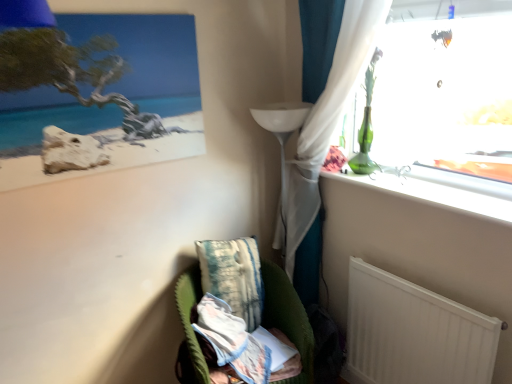
Question: From a real-world perspective, is velvet green armchair at lower center positioned under matte wooden picture frame at upper left based on gravity?

Choices:
 (A) yes
 (B) no

Answer: (A)

Question: Is velvet green armchair at lower center thinner than matte wooden picture frame at upper left?

Choices:
 (A) yes
 (B) no

Answer: (B)

Question: Is velvet green armchair at lower center positioned with its back to matte wooden picture frame at upper left?

Choices:
 (A) yes
 (B) no

Answer: (B)

Question: Considering the relative sizes of velvet green armchair at lower center and matte wooden picture frame at upper left in the image provided, is velvet green armchair at lower center bigger than matte wooden picture frame at upper left?

Choices:
 (A) yes
 (B) no

Answer: (A)

Question: Is the depth of velvet green armchair at lower center greater than that of matte wooden picture frame at upper left?

Choices:
 (A) no
 (B) yes

Answer: (B)

Question: Is velvet green armchair at lower center not close to matte wooden picture frame at upper left?

Choices:
 (A) no
 (B) yes

Answer: (B)

Question: From the image's perspective, is white matte radiator at lower right under velvet green armchair at lower center?

Choices:
 (A) yes
 (B) no

Answer: (B)

Question: Is white matte radiator at lower right bigger than velvet green armchair at lower center?

Choices:
 (A) no
 (B) yes

Answer: (A)

Question: Is white matte radiator at lower right turned away from velvet green armchair at lower center?

Choices:
 (A) no
 (B) yes

Answer: (A)

Question: Does white matte radiator at lower right appear on the left side of velvet green armchair at lower center?

Choices:
 (A) yes
 (B) no

Answer: (B)

Question: Is white matte radiator at lower right wider than velvet green armchair at lower center?

Choices:
 (A) no
 (B) yes

Answer: (A)

Question: Is white matte radiator at lower right closer to camera compared to velvet green armchair at lower center?

Choices:
 (A) no
 (B) yes

Answer: (B)

Question: Can you confirm if white matte radiator at lower right is wider than textured teal pillow at lower center?

Choices:
 (A) yes
 (B) no

Answer: (B)